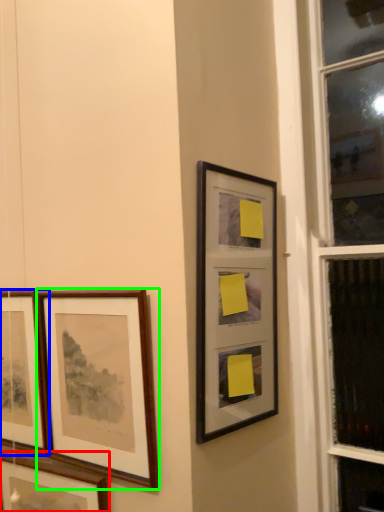
Question: Which object is the closest to the picture frame (highlighted by a red box)? Choose among these: picture frame (highlighted by a blue box) or picture frame (highlighted by a green box).

Choices:
 (A) picture frame
 (B) picture frame

Answer: (A)